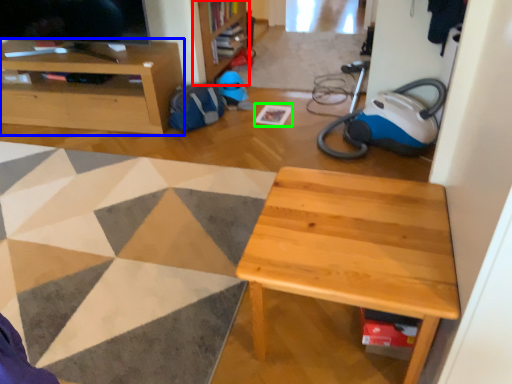
Question: Estimate the real-world distances between objects in this image. Which object is closer to bookshelf (highlighted by a red box), cabinetry (highlighted by a blue box) or square (highlighted by a green box)?

Choices:
 (A) cabinetry
 (B) square

Answer: (B)